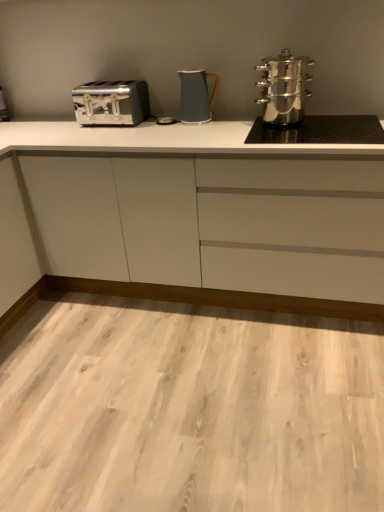
Question: From a real-world perspective, does satin silver toaster at left stand above white matte cabinet at center?

Choices:
 (A) no
 (B) yes

Answer: (B)

Question: Is satin silver toaster at left smaller than white matte cabinet at center?

Choices:
 (A) no
 (B) yes

Answer: (B)

Question: Is satin silver toaster at left outside of white matte cabinet at center?

Choices:
 (A) yes
 (B) no

Answer: (A)

Question: Is satin silver toaster at left further to the viewer compared to white matte cabinet at center?

Choices:
 (A) yes
 (B) no

Answer: (A)

Question: Does satin silver toaster at left lie in front of white matte cabinet at center?

Choices:
 (A) no
 (B) yes

Answer: (A)

Question: Would you say satin silver toaster at left contains white matte cabinet at center?

Choices:
 (A) no
 (B) yes

Answer: (A)

Question: Could you tell me if satin chrome toaster at left is facing matte blue pitcher at center, arranged as the second kitchen appliance when viewed from the right?

Choices:
 (A) yes
 (B) no

Answer: (B)

Question: Does satin chrome toaster at left come behind matte blue pitcher at center, marked as the first kitchen appliance in a left-to-right arrangement?

Choices:
 (A) no
 (B) yes

Answer: (B)

Question: Is satin chrome toaster at left shorter than matte blue pitcher at center, marked as the first kitchen appliance in a left-to-right arrangement?

Choices:
 (A) no
 (B) yes

Answer: (B)

Question: Can you confirm if satin chrome toaster at left is wider than matte blue pitcher at center, arranged as the second kitchen appliance when viewed from the right?

Choices:
 (A) yes
 (B) no

Answer: (A)

Question: Can matte blue pitcher at center, arranged as the second kitchen appliance when viewed from the right, be found inside satin chrome toaster at left?

Choices:
 (A) no
 (B) yes

Answer: (A)

Question: From a real-world perspective, does satin chrome toaster at left stand above matte blue pitcher at center, arranged as the second kitchen appliance when viewed from the right?

Choices:
 (A) no
 (B) yes

Answer: (A)

Question: Is satin chrome toaster at left outside white matte cabinet at center?

Choices:
 (A) no
 (B) yes

Answer: (B)